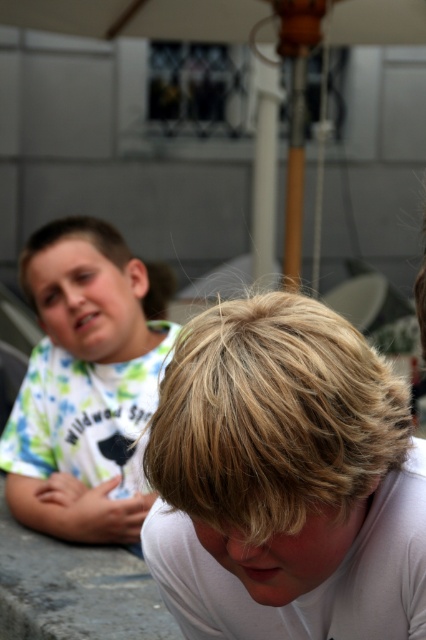
Is blonde hair at lower center shorter than light green t-shirt at left?

Yes.

Who is higher up, blonde hair at lower center or light green t-shirt at left?

light green t-shirt at left is above.

Locate an element on the screen. Image resolution: width=426 pixels, height=640 pixels. blonde hair at lower center is located at coordinates (284, 481).

Locate an element on the screen. The image size is (426, 640). blonde hair at lower center is located at coordinates (284, 481).